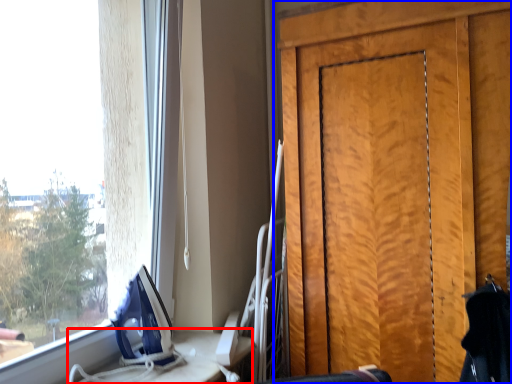
Question: Which point is closer to the camera, table (highlighted by a red box) or door (highlighted by a blue box)?

Choices:
 (A) table
 (B) door

Answer: (A)